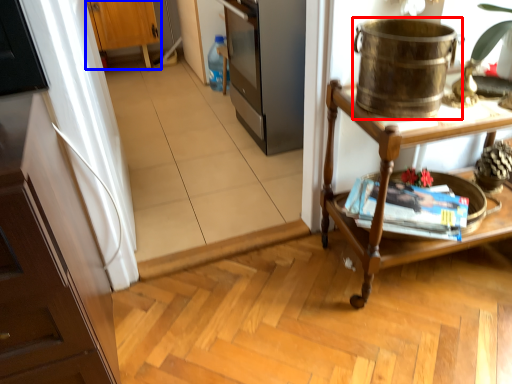
Question: Which of the following is the farthest to the observer, appliance (highlighted by a red box) or cabinetry (highlighted by a blue box)?

Choices:
 (A) appliance
 (B) cabinetry

Answer: (B)